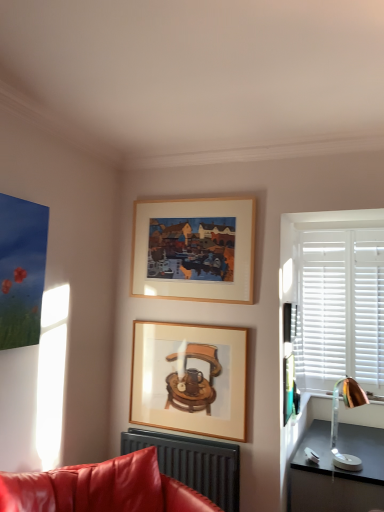
Question: Is copper metallic table lamp at right wider than matte black radiator at lower center?

Choices:
 (A) yes
 (B) no

Answer: (A)

Question: From the image's perspective, is copper metallic table lamp at right on top of matte black radiator at lower center?

Choices:
 (A) no
 (B) yes

Answer: (B)

Question: Does copper metallic table lamp at right appear on the right side of matte black radiator at lower center?

Choices:
 (A) no
 (B) yes

Answer: (B)

Question: Can you confirm if copper metallic table lamp at right is bigger than matte black radiator at lower center?

Choices:
 (A) yes
 (B) no

Answer: (B)

Question: Does copper metallic table lamp at right have a lesser height compared to matte black radiator at lower center?

Choices:
 (A) yes
 (B) no

Answer: (B)

Question: Is the depth of copper metallic table lamp at right less than that of matte black radiator at lower center?

Choices:
 (A) no
 (B) yes

Answer: (A)

Question: Is matte black radiator at lower center shorter than copper metallic table lamp at right?

Choices:
 (A) yes
 (B) no

Answer: (A)

Question: From the image's perspective, is matte black radiator at lower center on copper metallic table lamp at right?

Choices:
 (A) yes
 (B) no

Answer: (B)

Question: Does matte black radiator at lower center lie in front of copper metallic table lamp at right?

Choices:
 (A) yes
 (B) no

Answer: (A)

Question: Is matte black radiator at lower center positioned behind copper metallic table lamp at right?

Choices:
 (A) yes
 (B) no

Answer: (B)

Question: From a real-world perspective, does matte black radiator at lower center stand above copper metallic table lamp at right?

Choices:
 (A) yes
 (B) no

Answer: (B)

Question: From a real-world perspective, is matte black radiator at lower center below copper metallic table lamp at right?

Choices:
 (A) yes
 (B) no

Answer: (A)

Question: Is metallic gold lamp at right thinner than matte black radiator at lower center?

Choices:
 (A) no
 (B) yes

Answer: (B)